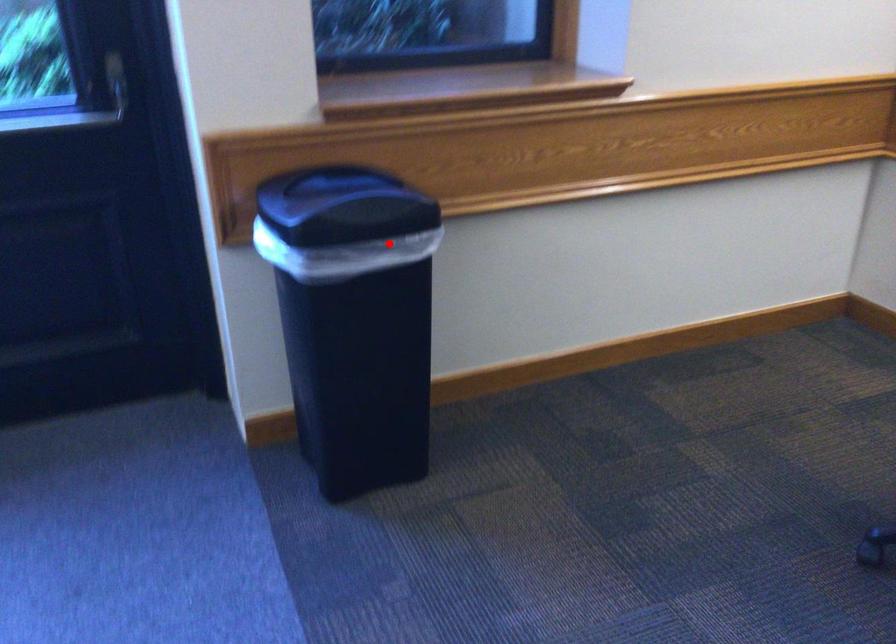
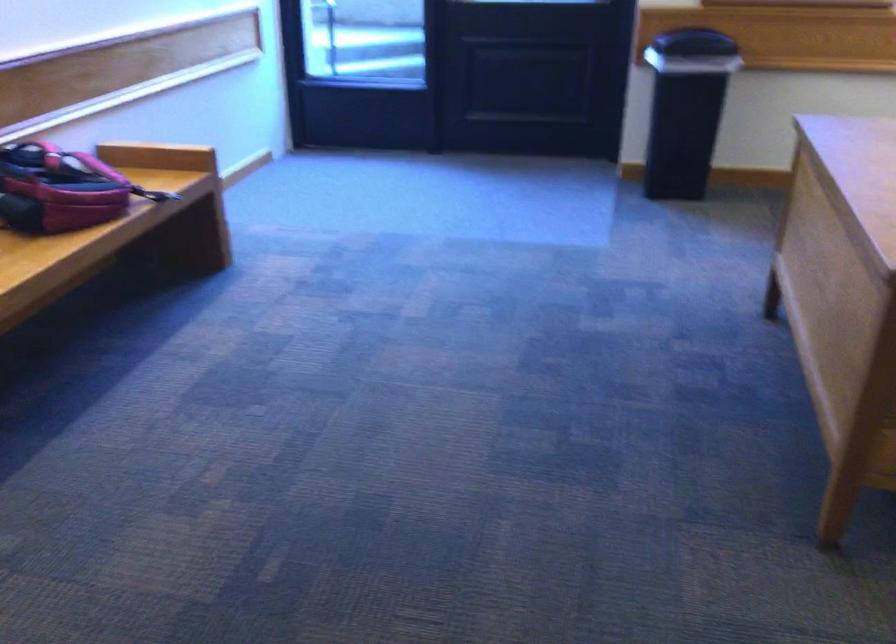
Question: I am providing you with two images of the same scene from different viewpoints. Image1 has a red point marked. In image2, the corresponding 3D location appears at what relative position? Reply with the corresponding letter.

Choices:
 (A) Closer
 (B) Farther

Answer: (B)